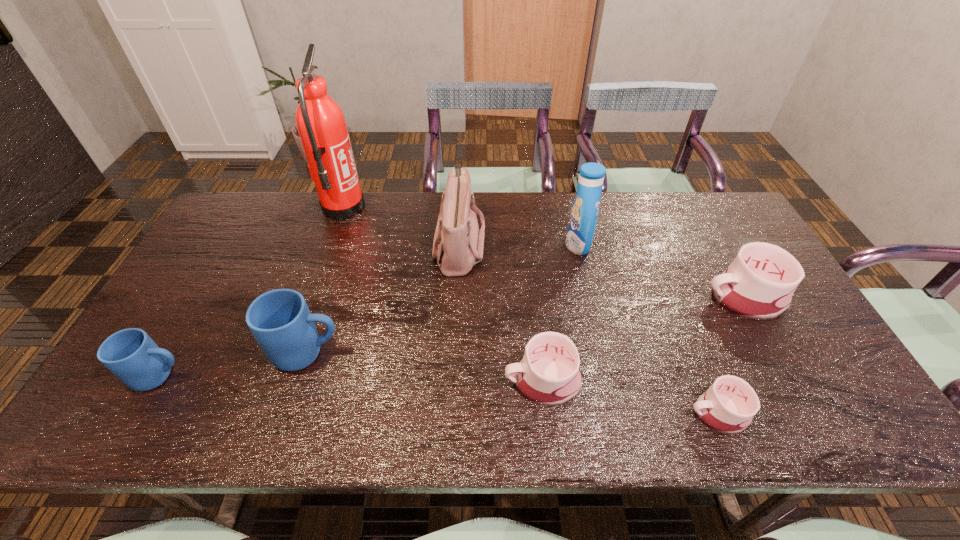
What are the coordinates of `vacant space in between the shortest object and the biggest white mug` in the screenshot? It's located at (731, 355).

Locate an element on the screen. The width and height of the screenshot is (960, 540). free space between the left blue mug and the leftmost white mug is located at coordinates (351, 379).

At what (x,y) coordinates should I click in order to perform the action: click on vacant space that is in between the fifth shortest object and the leftmost object. Please return your answer as a coordinate pair (x, y). Looking at the image, I should click on (234, 364).

What are the coordinates of `free point between the second white mug from left to right and the detergent` in the screenshot? It's located at (648, 329).

Locate an element on the screen. This screenshot has height=540, width=960. free space between the smaller blue mug and the fire extinguisher is located at coordinates (252, 292).

Locate an element on the screen. The image size is (960, 540). vacant point located between the third mug from left to right and the smaller blue mug is located at coordinates tap(351, 379).

Where is `free space between the seventh shortest object and the shoulder bag`? Image resolution: width=960 pixels, height=540 pixels. free space between the seventh shortest object and the shoulder bag is located at coordinates (518, 244).

At what (x,y) coordinates should I click in order to perform the action: click on empty location between the third object from right to left and the shortest object. Please return your answer as a coordinate pair (x, y). Looking at the image, I should click on (648, 329).

This screenshot has height=540, width=960. I want to click on vacant area between the detergent and the leftmost object, so click(370, 310).

Where is `object that stands as the closest to the biggest white mug`? The image size is (960, 540). object that stands as the closest to the biggest white mug is located at coordinates (728, 406).